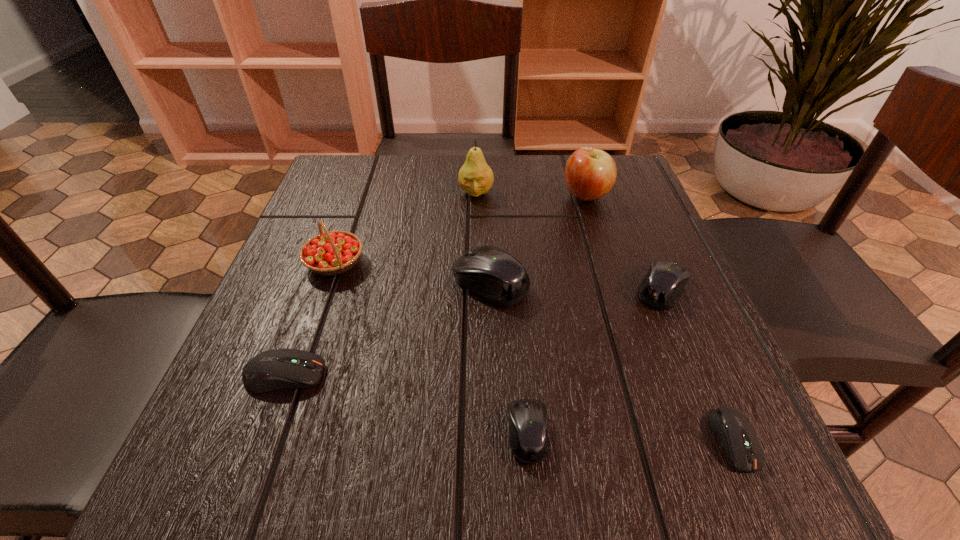
Locate an element on the screen. pear that is at the far edge is located at coordinates (475, 177).

Image resolution: width=960 pixels, height=540 pixels. Identify the location of apple that is at the far edge. (590, 173).

The height and width of the screenshot is (540, 960). In order to click on strawberry at the left edge in this screenshot , I will do `click(330, 253)`.

The width and height of the screenshot is (960, 540). I want to click on computer equipment that is positioned at the left edge, so click(x=275, y=369).

Where is `apple that is at the right edge`? apple that is at the right edge is located at coordinates (590, 173).

I want to click on object located at the far right corner, so click(x=590, y=173).

Image resolution: width=960 pixels, height=540 pixels. Identify the location of object positioned at the near right corner. (735, 432).

In order to click on vacant area at the far edge of the desktop in this screenshot , I will do `click(430, 191)`.

Identify the location of free space at the left edge of the desktop. (288, 287).

In the image, there is a desktop. What are the coordinates of `vacant area at the right edge` in the screenshot? It's located at (604, 285).